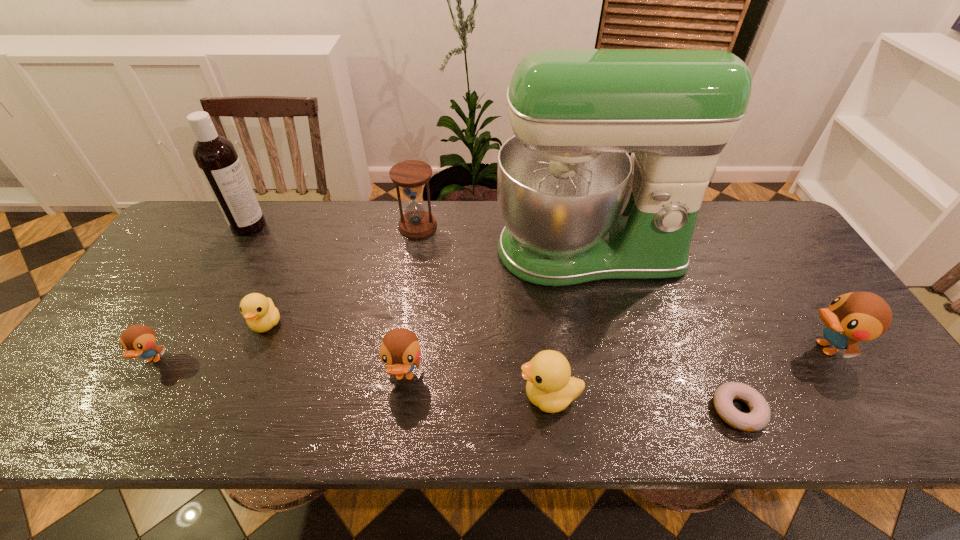
You are a GUI agent. You are given a task and a screenshot of the screen. Output one action in this format:
    pyautogui.click(x=<x>, y=<y>)
    Task: Click on the free space that satisfies the following two spatial constraints: 1. on the label side of the dishwasher detergent; 2. on the front-facing side of the leftmost duck
    This screenshot has width=960, height=540.
    Given the screenshot: What is the action you would take?
    pyautogui.click(x=172, y=360)

Identify the location of free location that satisfies the following two spatial constraints: 1. on the front-facing side of the tallest duck; 2. on the front-facing side of the third duck from left to right. The height and width of the screenshot is (540, 960). tap(843, 377).

What are the coordinates of `vacant space that satisfies the following two spatial constraints: 1. on the label side of the doughnut; 2. on the left side of the second tallest object` in the screenshot? It's located at (143, 410).